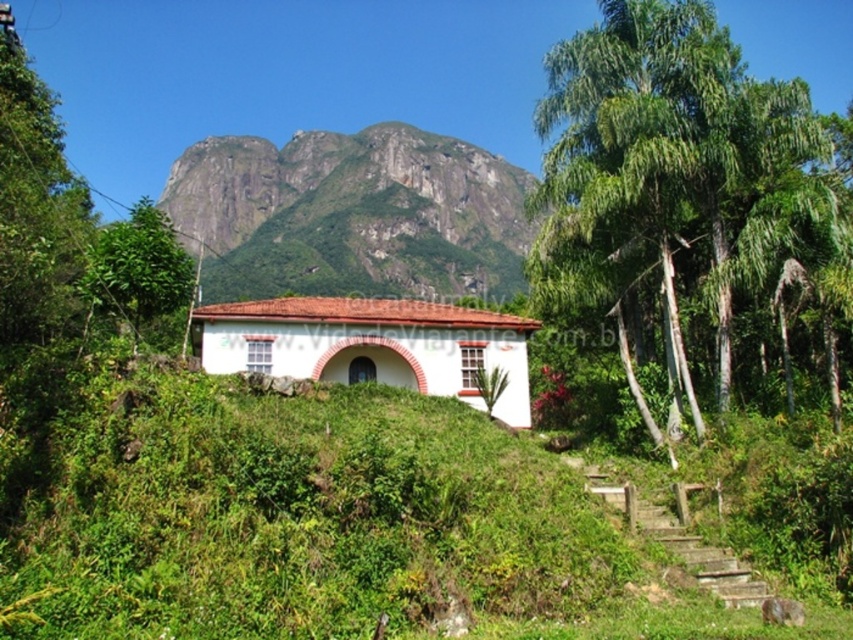
Between rocky cliff at upper center and green leafy tree at left, which one appears on the left side from the viewer's perspective?

From the viewer's perspective, green leafy tree at left appears more on the left side.

Which is below, rocky cliff at upper center or green leafy tree at left?

green leafy tree at left is lower down.

Who is more forward, (280, 230) or (108, 307)?

Point (108, 307)

At what (x,y) coordinates should I click in order to perform the action: click on rocky cliff at upper center. Please return your answer as a coordinate pair (x, y). The image size is (853, 640). Looking at the image, I should click on (352, 214).

Who is shorter, green leafy palm at center right or green leafy tree at left?

Standing shorter between the two is green leafy palm at center right.

This screenshot has width=853, height=640. I want to click on green leafy palm at center right, so click(672, 173).

Image resolution: width=853 pixels, height=640 pixels. What do you see at coordinates (672, 173) in the screenshot?
I see `green leafy palm at center right` at bounding box center [672, 173].

Describe the element at coordinates (672, 173) in the screenshot. I see `green leafy palm at center right` at that location.

The image size is (853, 640). In order to click on green leafy palm at center right in this screenshot , I will do pos(672,173).